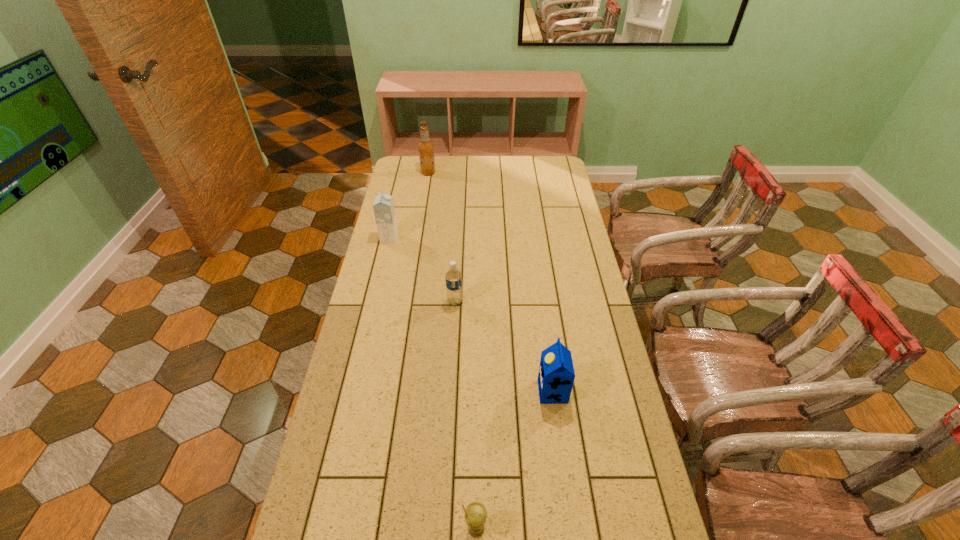
Where is `the farthest object`? the farthest object is located at coordinates (426, 149).

The image size is (960, 540). Find the location of `beer bottle`. beer bottle is located at coordinates pos(426,149).

Image resolution: width=960 pixels, height=540 pixels. I want to click on the second farthest object, so point(383,206).

The width and height of the screenshot is (960, 540). Identify the location of the left carton. (383, 206).

You are a GUI agent. You are given a task and a screenshot of the screen. Output one action in this format:
    pyautogui.click(x=<x>, y=<y>)
    Task: Click on the nearer carton
    The width and height of the screenshot is (960, 540).
    Given the screenshot: What is the action you would take?
    556,375

Find the location of `the fourth farthest object`. the fourth farthest object is located at coordinates (556, 375).

The width and height of the screenshot is (960, 540). Identify the location of the third farthest object. (453, 276).

You are a GUI agent. You are given a task and a screenshot of the screen. Output one action in this format:
    pyautogui.click(x=<x>, y=<y>)
    Task: Click on the water bottle
    The width and height of the screenshot is (960, 540).
    Given the screenshot: What is the action you would take?
    pyautogui.click(x=453, y=276)

You are a GUI agent. You are given a task and a screenshot of the screen. Output one action in this format:
    pyautogui.click(x=<x>, y=<y>)
    Task: Click on the blank space located on the front label of the tallest object
    The height and width of the screenshot is (540, 960).
    Given the screenshot: What is the action you would take?
    pyautogui.click(x=456, y=173)

Identify the location of vacant region located 0.340m on the front label of the fourth nearest object. This screenshot has height=540, width=960. (480, 238).